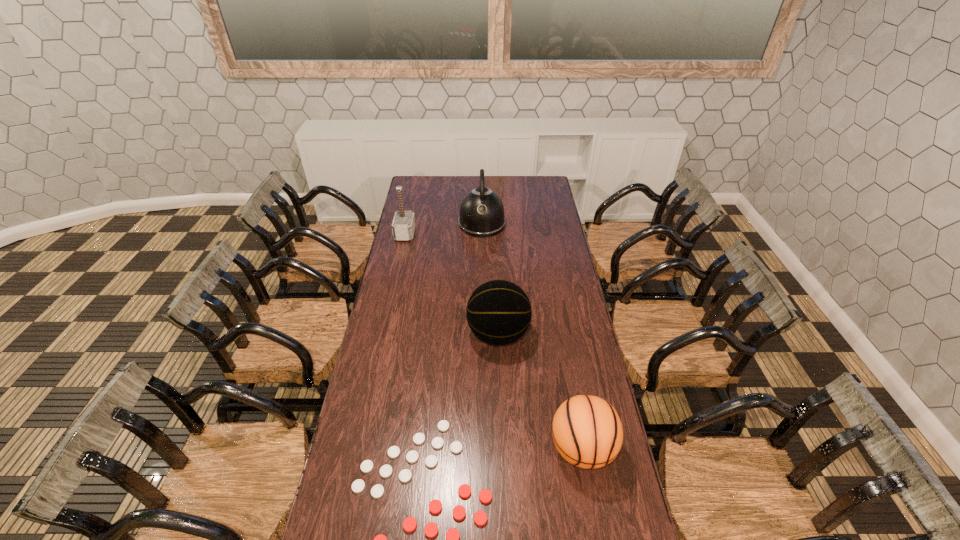
Locate an element on the screen. object at the left edge is located at coordinates (403, 226).

This screenshot has height=540, width=960. I want to click on object present at the right edge, so (x=587, y=431).

In order to click on free space at the far edge of the desktop in this screenshot , I will do `click(498, 181)`.

Where is `vacant space at the left edge of the desktop`? vacant space at the left edge of the desktop is located at coordinates (372, 436).

This screenshot has width=960, height=540. In the image, there is a desktop. Find the location of `free space at the right edge`. free space at the right edge is located at coordinates (566, 361).

At what (x,y) coordinates should I click in order to perform the action: click on vacant space at the far left corner of the desktop. Please return your answer as a coordinate pair (x, y). The height and width of the screenshot is (540, 960). Looking at the image, I should click on (409, 185).

Locate an element on the screen. This screenshot has height=540, width=960. vacant space that's between the fourth tallest object and the farther basketball is located at coordinates (540, 392).

Find the location of `vacant space that's between the hammer and the taller basketball`. vacant space that's between the hammer and the taller basketball is located at coordinates (451, 284).

Locate an element on the screen. The image size is (960, 540). vacant space that is in between the hammer and the kettle is located at coordinates (444, 229).

In order to click on vacant space that's between the kettle and the hammer in this screenshot , I will do `click(444, 229)`.